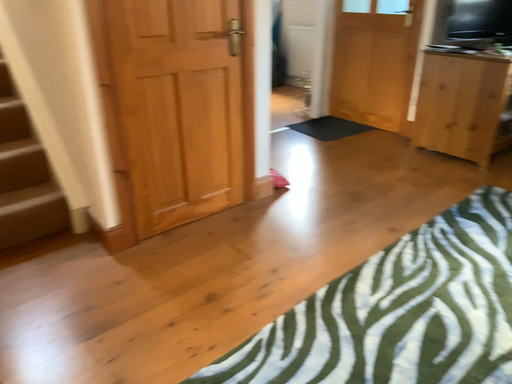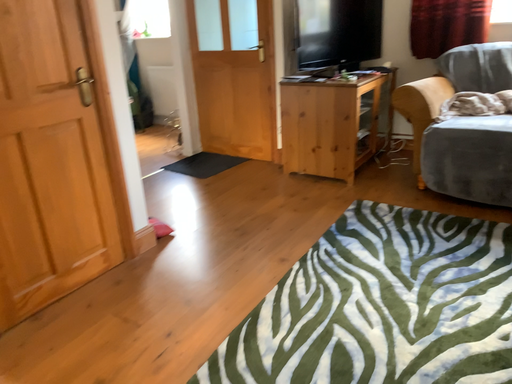
Question: Which way did the camera rotate in the video?

Choices:
 (A) rotated left
 (B) rotated right

Answer: (B)